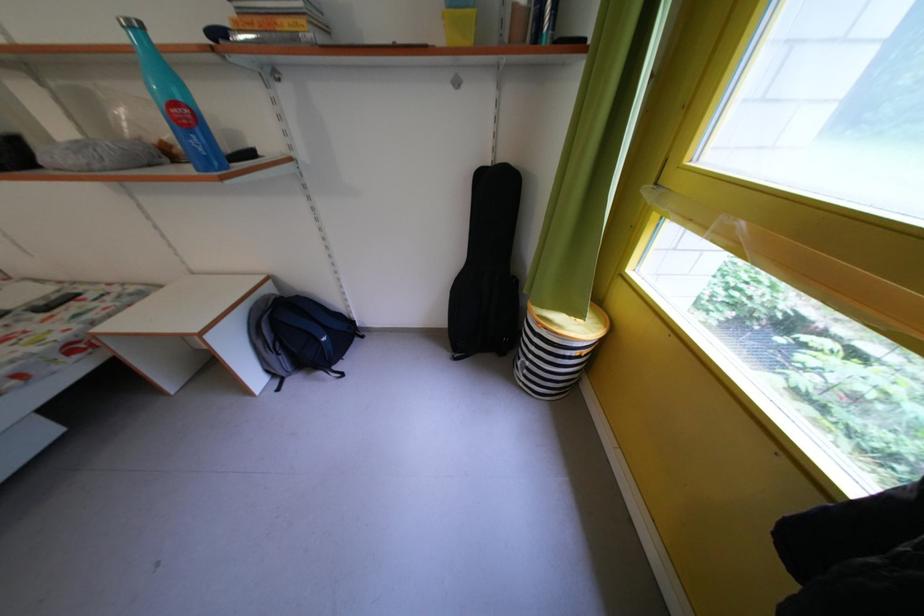
Where would you lift the blue and black backpack? Please return your answer as a coordinate pair (x, y).

(298, 334)